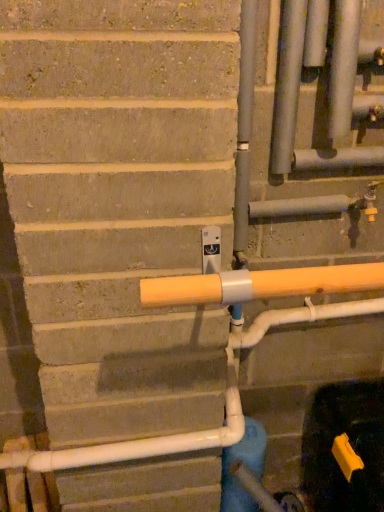
Question: Could you tell me if blue matte water pipe at lower center is facing matte silver pipe at upper right, the 2th pipe when ordered from left to right?

Choices:
 (A) yes
 (B) no

Answer: (B)

Question: From a real-world perspective, does blue matte water pipe at lower center stand above matte silver pipe at upper right, arranged as the 1th pipe when viewed from the right?

Choices:
 (A) yes
 (B) no

Answer: (B)

Question: Is blue matte water pipe at lower center not near matte silver pipe at upper right, the 2th pipe when ordered from left to right?

Choices:
 (A) no
 (B) yes

Answer: (A)

Question: Is blue matte water pipe at lower center next to matte silver pipe at upper right, the 2th pipe when ordered from left to right, and touching it?

Choices:
 (A) no
 (B) yes

Answer: (A)

Question: Does blue matte water pipe at lower center lie behind matte silver pipe at upper right, arranged as the 1th pipe when viewed from the right?

Choices:
 (A) yes
 (B) no

Answer: (A)

Question: Considering the positions of matte silver pipe at upper right, arranged as the 1th pipe when viewed from the right, and blue matte water pipe at lower center in the image, is matte silver pipe at upper right, arranged as the 1th pipe when viewed from the right, wider or thinner than blue matte water pipe at lower center?

Choices:
 (A) wide
 (B) thin

Answer: (B)

Question: Is matte silver pipe at upper right, arranged as the 1th pipe when viewed from the right, to the left or to the right of blue matte water pipe at lower center in the image?

Choices:
 (A) right
 (B) left

Answer: (A)

Question: From a real-world perspective, relative to blue matte water pipe at lower center, is matte silver pipe at upper right, arranged as the 1th pipe when viewed from the right, vertically above or below?

Choices:
 (A) below
 (B) above

Answer: (B)

Question: In terms of height, does matte silver pipe at upper right, arranged as the 1th pipe when viewed from the right, look taller or shorter compared to blue matte water pipe at lower center?

Choices:
 (A) short
 (B) tall

Answer: (B)

Question: Is satin silver pipes at upper right, marked as the second pipe in a right-to-left arrangement, in front of or behind blue matte water pipe at lower center in the image?

Choices:
 (A) front
 (B) behind

Answer: (A)

Question: In terms of height, does satin silver pipes at upper right, marked as the second pipe in a right-to-left arrangement, look taller or shorter compared to blue matte water pipe at lower center?

Choices:
 (A) tall
 (B) short

Answer: (B)

Question: In terms of size, does satin silver pipes at upper right, placed as the 1th pipe when sorted from left to right, appear bigger or smaller than blue matte water pipe at lower center?

Choices:
 (A) big
 (B) small

Answer: (B)

Question: From a real-world perspective, is satin silver pipes at upper right, marked as the second pipe in a right-to-left arrangement, above or below blue matte water pipe at lower center?

Choices:
 (A) below
 (B) above

Answer: (B)

Question: From their relative heights in the image, would you say blue matte water pipe at lower center is taller or shorter than satin silver pipes at upper right, placed as the 1th pipe when sorted from left to right?

Choices:
 (A) tall
 (B) short

Answer: (A)

Question: From a real-world perspective, is blue matte water pipe at lower center above or below satin silver pipes at upper right, placed as the 1th pipe when sorted from left to right?

Choices:
 (A) below
 (B) above

Answer: (A)